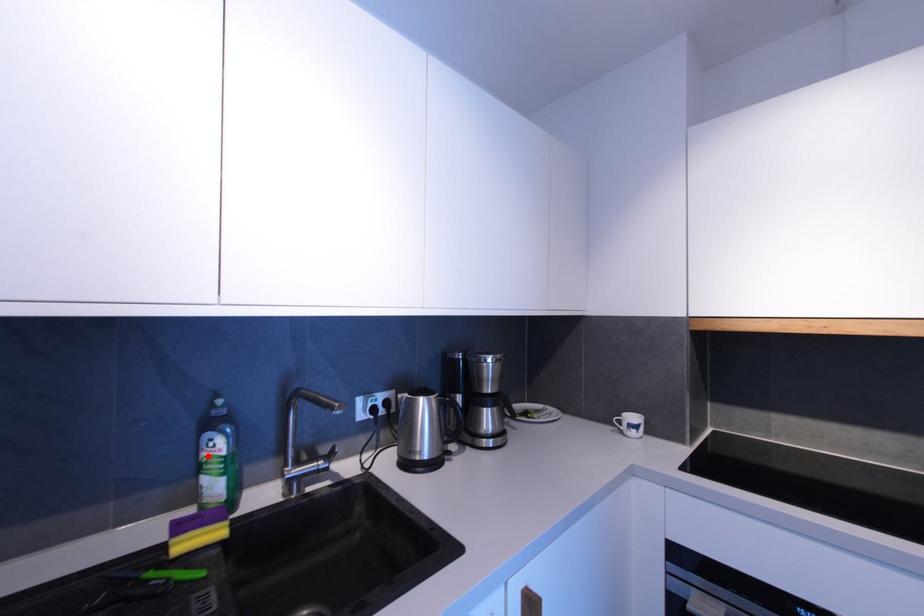
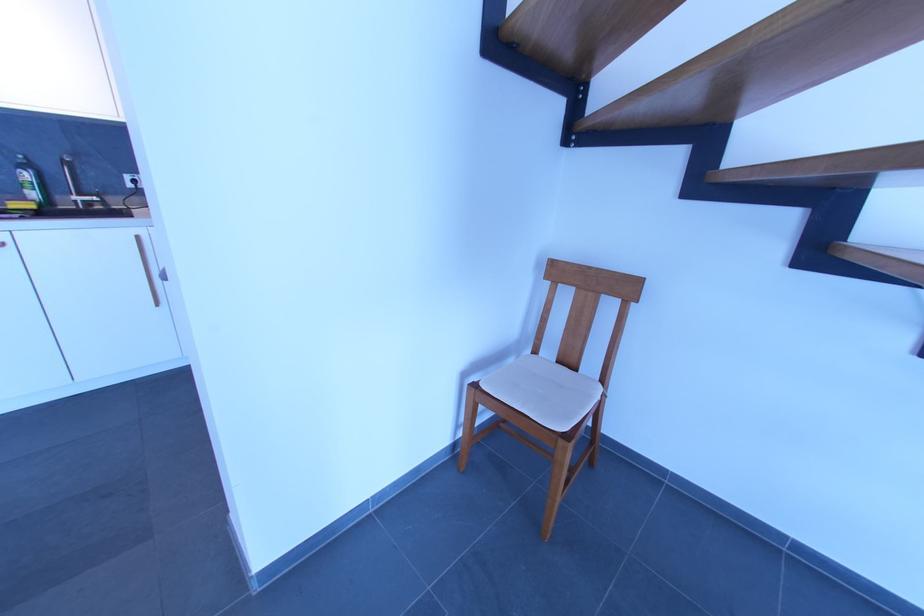
Question: I am providing you with two images of the same scene from different viewpoints. Image1 has a red point marked. In image2, the corresponding 3D location appears at what relative position? Reply with the corresponding letter.

Choices:
 (A) Closer
 (B) Farther

Answer: (B)